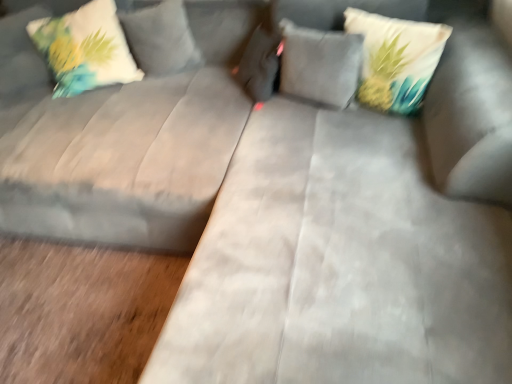
Question: In terms of height, does white fabric pillow with floral design at upper left, the 1th pillow positioned from the left, look taller or shorter compared to suede gray couch at center?

Choices:
 (A) short
 (B) tall

Answer: (A)

Question: From a real-world perspective, relative to suede gray couch at center, is white fabric pillow with floral design at upper left, positioned as the third pillow in right-to-left order, vertically above or below?

Choices:
 (A) below
 (B) above

Answer: (B)

Question: Based on their relative distances, which object is farther from the white fabric pillow with floral design at upper left, the 1th pillow positioned from the left?

Choices:
 (A) suede gray couch at center
 (B) printed fabric pillow at upper right, the third pillow in the left-to-right sequence
 (C) suede gray pillow at center, which ranks as the 2th pillow in right-to-left order

Answer: (B)

Question: Which object is the closest to the suede gray pillow at center, which ranks as the 2th pillow in right-to-left order?

Choices:
 (A) suede gray couch at center
 (B) white fabric pillow with floral design at upper left, the 1th pillow positioned from the left
 (C) printed fabric pillow at upper right, the third pillow in the left-to-right sequence

Answer: (C)